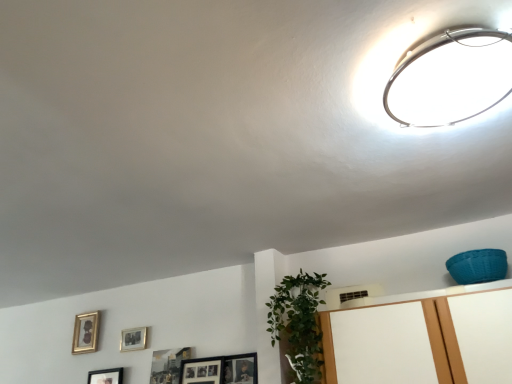
Question: From the image's perspective, is gold metallic picture frame at lower left, the 4th picture frame in the right-to-left sequence, located above or below matte silver picture frame at upper center, which appears as the second picture frame when viewed from the right?

Choices:
 (A) below
 (B) above

Answer: (A)

Question: In the image, is gold metallic picture frame at lower left, the 4th picture frame in the right-to-left sequence, on the left side or the right side of matte silver picture frame at upper center, which is the third picture frame from left to right?

Choices:
 (A) left
 (B) right

Answer: (A)

Question: Which is nearer to the gold metallic picture frame at lower left, which is the 1th picture frame from left to right?

Choices:
 (A) black glossy picture frame at lower left, which ranks as the 3th picture frame in right-to-left order
 (B) green leafy plant at lower center
 (C) metallic silver picture frame at lower center, which ranks as the 4th picture frame in left-to-right order
 (D) matte silver picture frame at upper center, which is the third picture frame from left to right
 (E) metallic ring light at upper right

Answer: (A)

Question: Which object is the farthest from the black glossy picture frame at lower left, which ranks as the 3th picture frame in right-to-left order?

Choices:
 (A) green leafy plant at lower center
 (B) metallic silver picture frame at lower center, which is the first picture frame in right-to-left order
 (C) gold metallic picture frame at lower left, the 4th picture frame in the right-to-left sequence
 (D) matte silver picture frame at upper center, which appears as the second picture frame when viewed from the right
 (E) metallic ring light at upper right

Answer: (E)